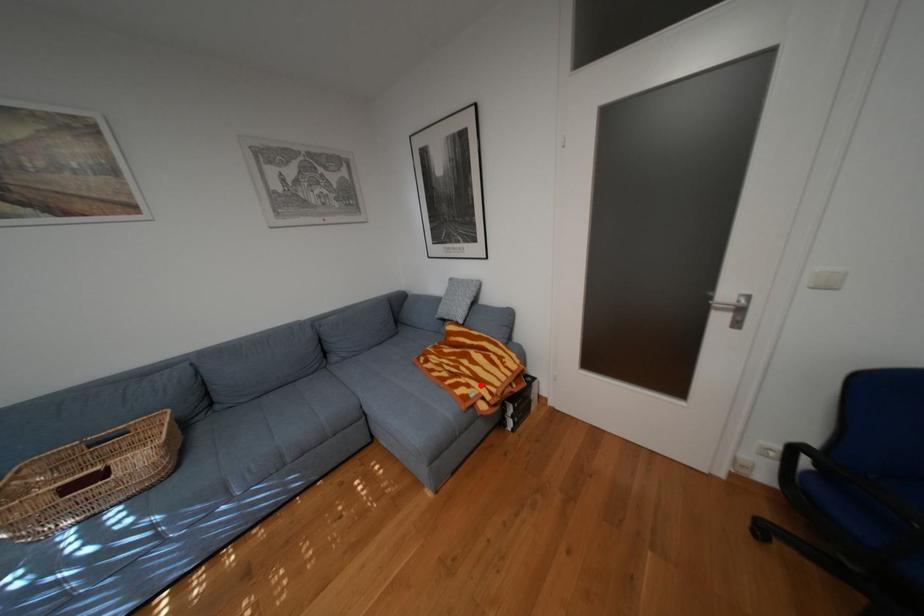
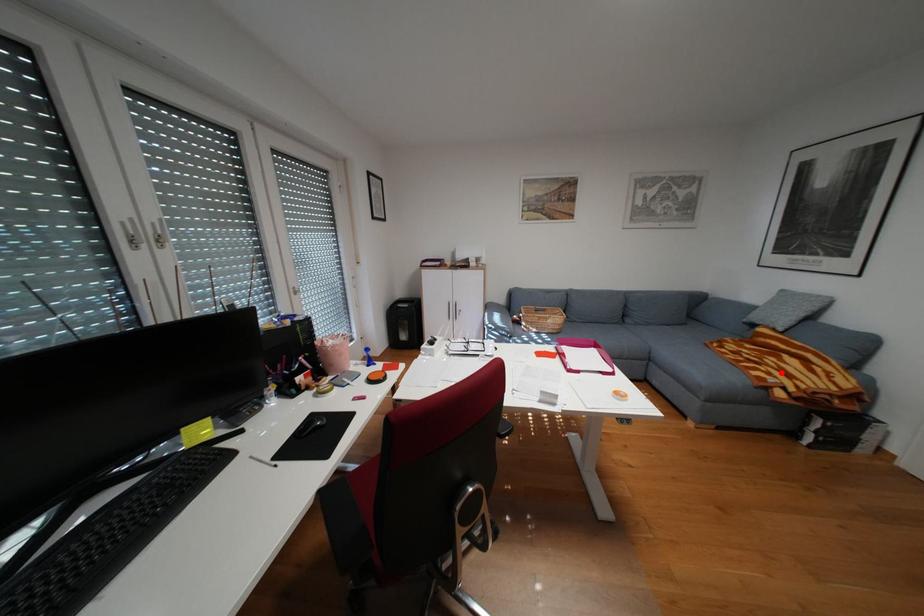
I am providing you with two images of the same scene from different viewpoints. A red point is marked on the first image and another point is marked on the second image. Is the red point in image1 aligned with the point shown in image2?

Yes